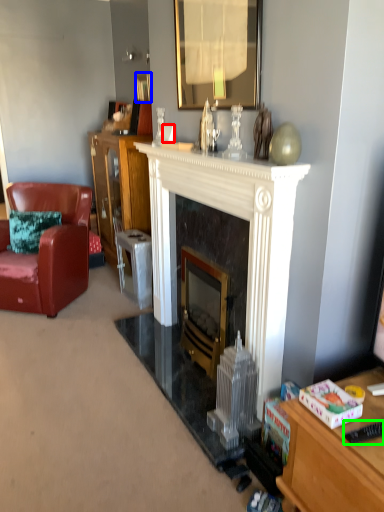
Question: Which object is the farthest from coffee cup (highlighted by a red box)? Choose among these: picture frame (highlighted by a blue box) or remote control (highlighted by a green box).

Choices:
 (A) picture frame
 (B) remote control

Answer: (B)